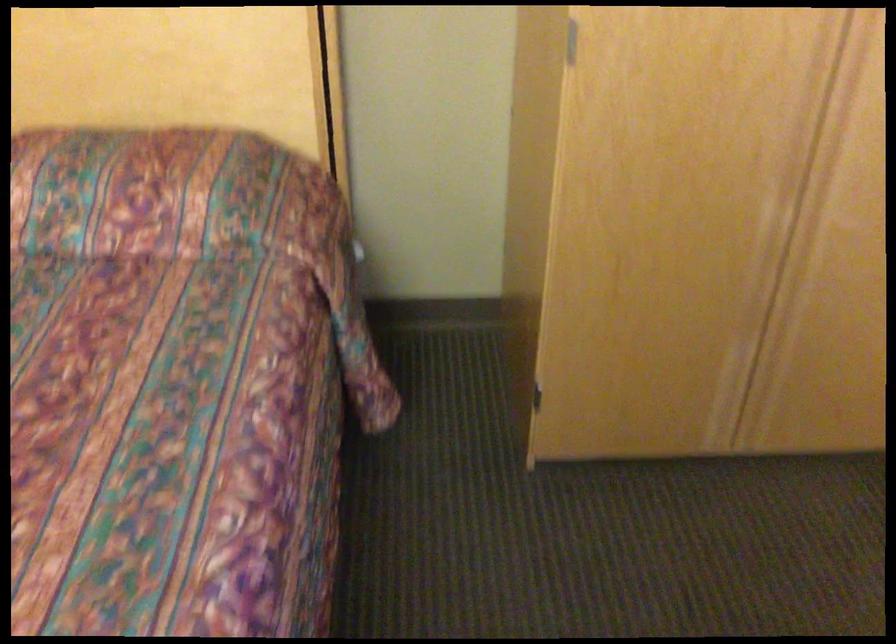
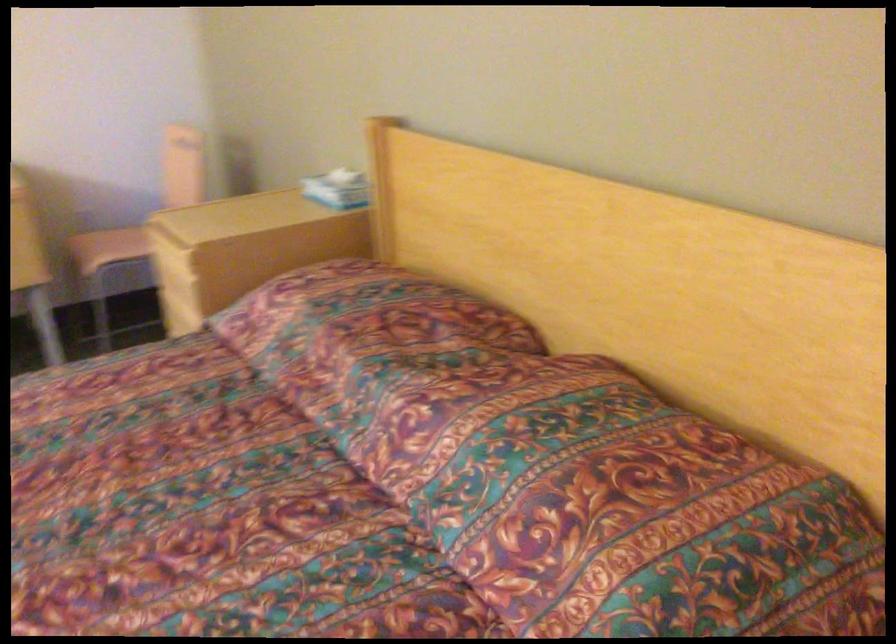
The point at (186, 165) is marked in the first image. Where is the corresponding point in the second image?

(631, 512)